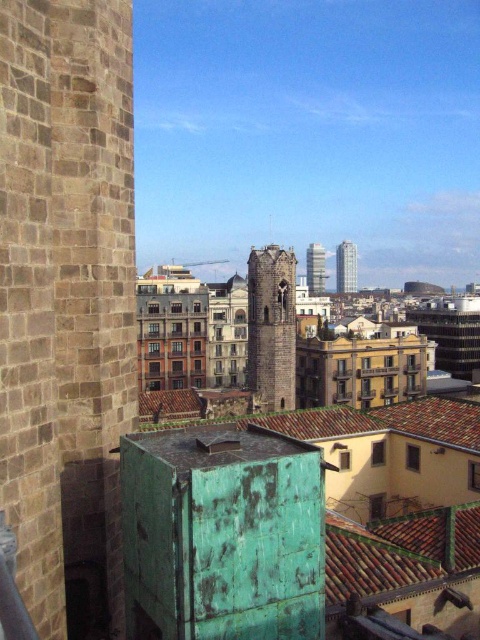
Question: Which point is closer to the camera?

Choices:
 (A) (294, 372)
 (B) (348, 257)
 (C) (324, 275)

Answer: (A)

Question: Which point is farther from the camera taking this photo?

Choices:
 (A) 346,292
 (B) 264,256

Answer: (A)

Question: Can you confirm if brown stone tower at center is positioned to the left of glassy reflective skyscraper at upper right?

Choices:
 (A) no
 (B) yes

Answer: (B)

Question: Does glassy reflective skyscraper at upper right have a lesser width compared to glassy reflective skyscraper at center?

Choices:
 (A) no
 (B) yes

Answer: (B)

Question: Is glassy reflective skyscraper at upper right wider than glassy reflective skyscraper at center?

Choices:
 (A) yes
 (B) no

Answer: (B)

Question: Which object appears closest to the camera in this image?

Choices:
 (A) brown stone tower at center
 (B) glassy reflective skyscraper at upper right
 (C) glassy reflective skyscraper at center

Answer: (A)